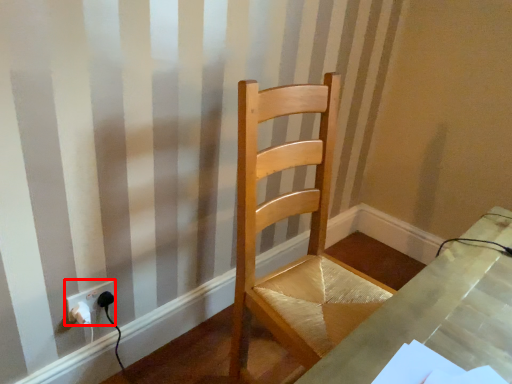
Question: From the image's perspective, where is electric outlet (annotated by the red box) located relative to chair?

Choices:
 (A) below
 (B) above

Answer: (A)